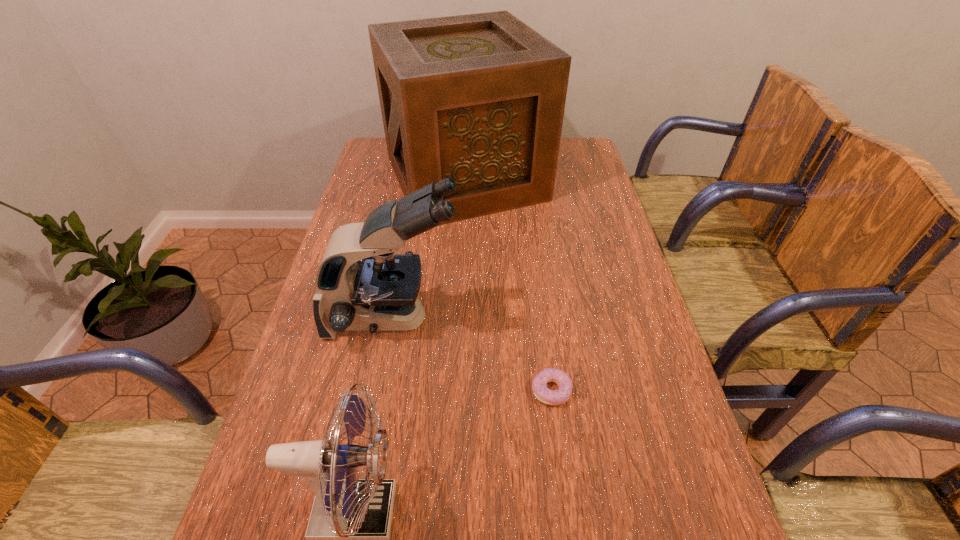
Select which object appears as the closest to the shortest object. Please provide its 2D coordinates. Your answer should be formatted as a tuple, i.e. [(x, y)], where the tuple contains the x and y coordinates of a point satisfying the conditions above.

[(380, 292)]

Choose which object is the nearest neighbor to the nearest object. Please provide its 2D coordinates. Your answer should be formatted as a tuple, i.e. [(x, y)], where the tuple contains the x and y coordinates of a point satisfying the conditions above.

[(380, 292)]

The width and height of the screenshot is (960, 540). In order to click on vacant space that satisfies the following two spatial constraints: 1. on the front side of the box; 2. through the eyepieces of the microscope in this screenshot , I will do `click(459, 318)`.

I want to click on free space that satisfies the following two spatial constraints: 1. through the eyepieces of the third farthest object; 2. on the right side of the third nearest object, so click(x=380, y=390).